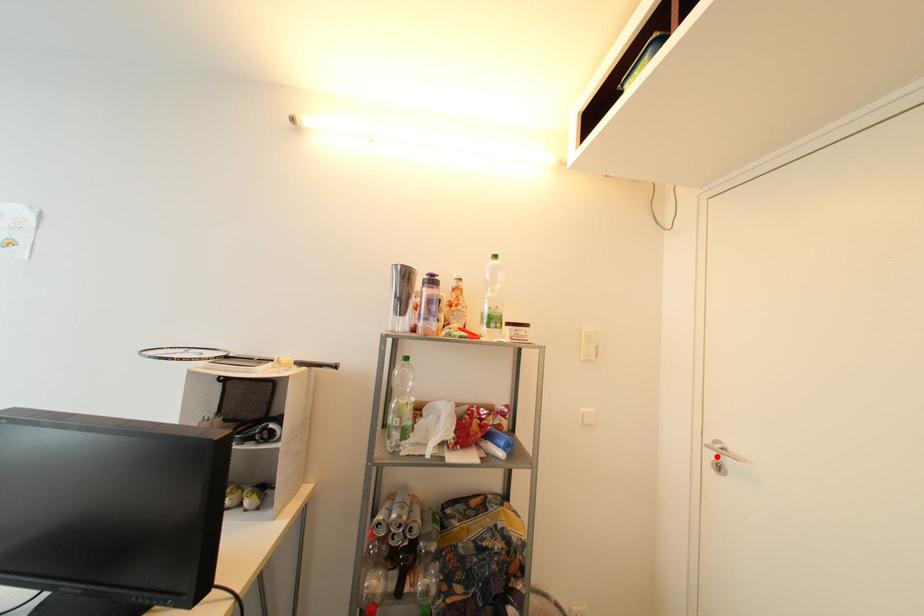
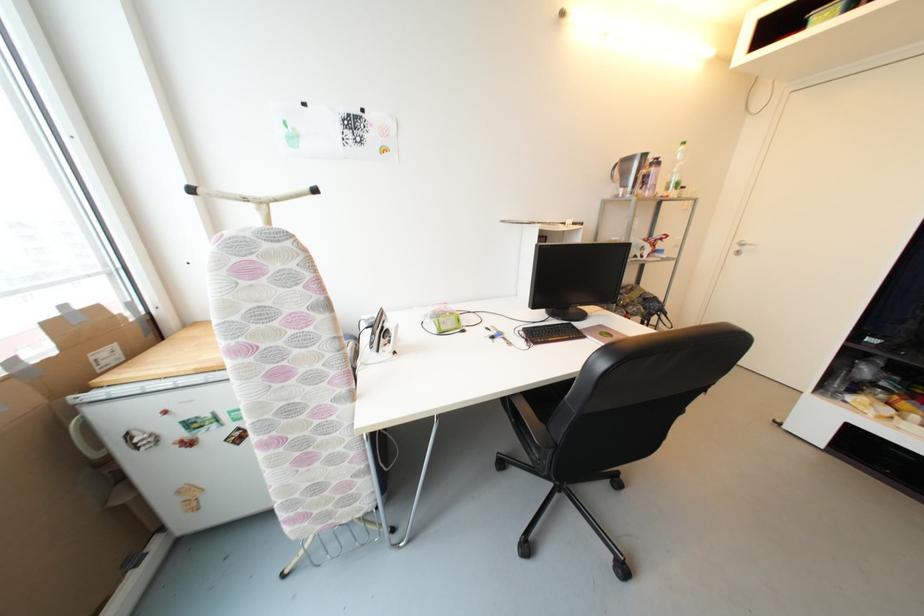
Locate, in the second image, the point that corresponds to the highlighted location in the first image.

(742, 249)